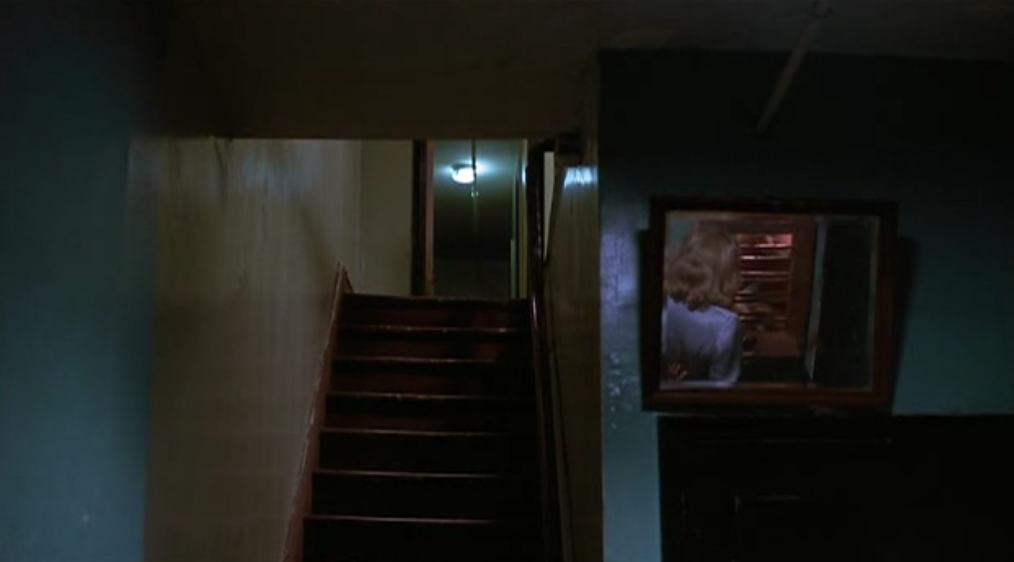
Locate an element on the screen. The image size is (1014, 562). mirror is located at coordinates (852, 299).